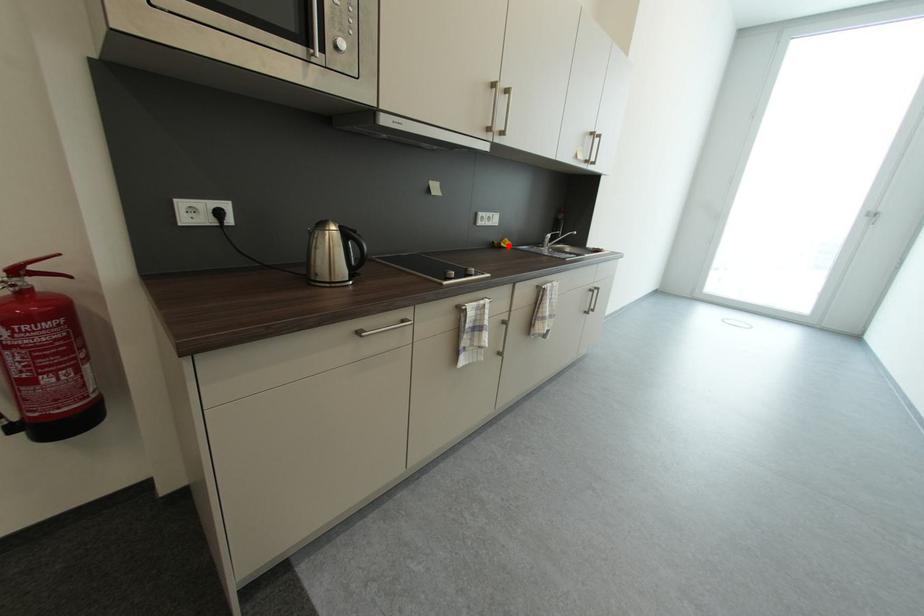
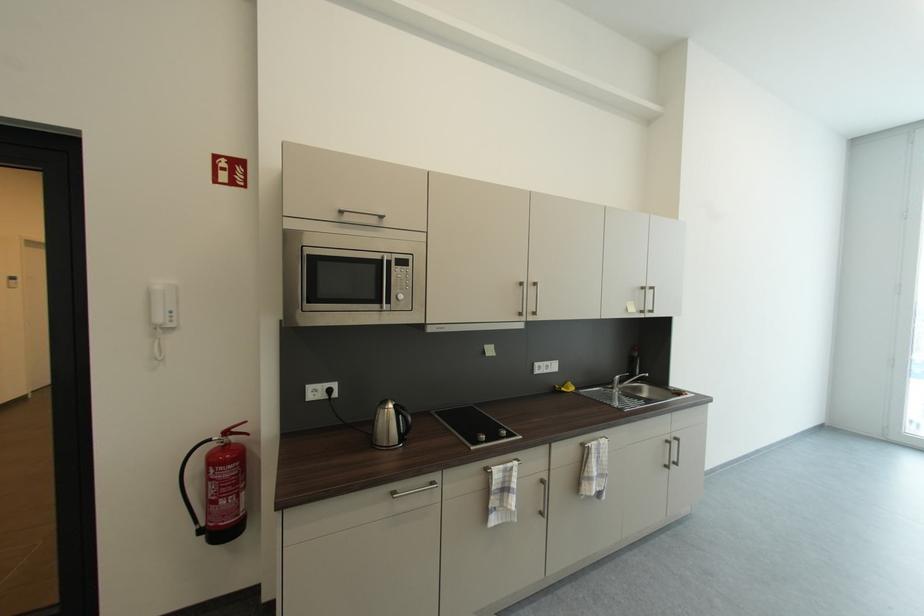
Question: I am providing you with two images of the same scene from different viewpoints. A red point is shown in image1. For the corresponding object point in image2, is it positioned nearer or farther from the camera?

Choices:
 (A) Nearer
 (B) Farther

Answer: (B)